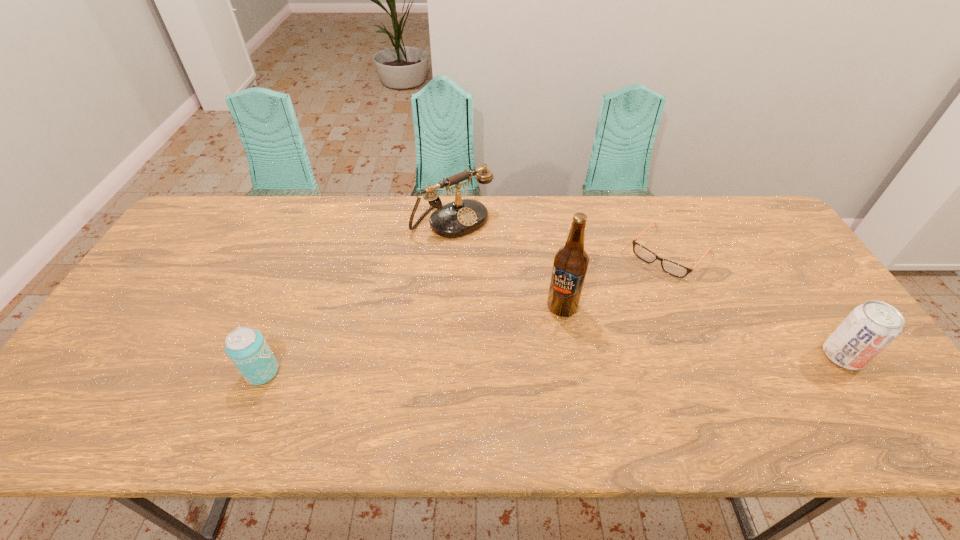
At what (x,y) coordinates should I click in order to perform the action: click on free spot on the desktop that is between the fourth tallest object and the rightmost object and is positioned on the front-facing side of the spectacles. Please return your answer as a coordinate pair (x, y). Looking at the image, I should click on (568, 363).

You are a GUI agent. You are given a task and a screenshot of the screen. Output one action in this format:
    pyautogui.click(x=<x>, y=<y>)
    Task: Click on the vacant space on the desktop that is between the leftmost object and the soda can and is positioned on the dial of the telephone
    
    Given the screenshot: What is the action you would take?
    pyautogui.click(x=604, y=362)

The height and width of the screenshot is (540, 960). In order to click on free space on the desktop that is between the beer can and the rightmost object and is positioned on the label of the third nearest object in this screenshot , I will do `click(508, 366)`.